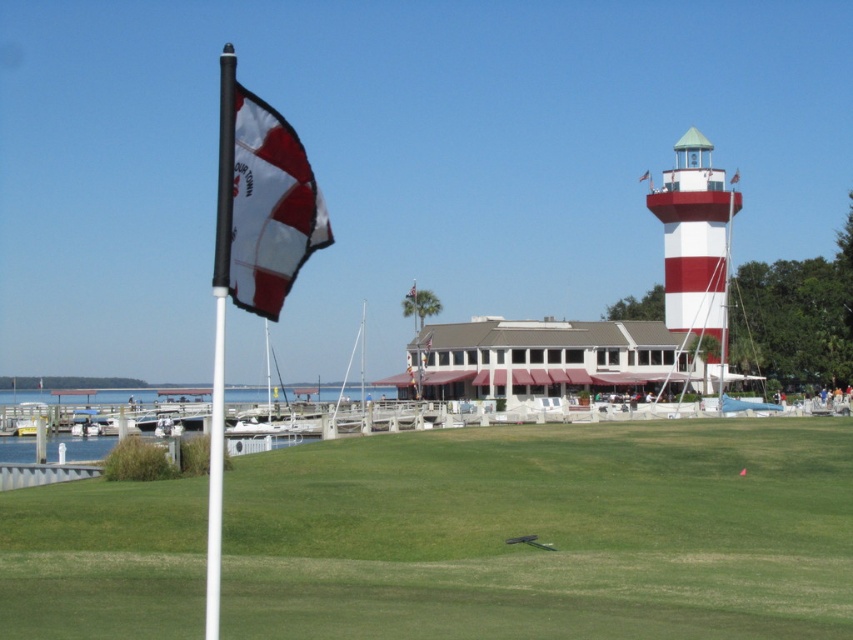
Question: Which point is closer to the camera?

Choices:
 (A) (386, 600)
 (B) (223, 346)
 (C) (682, 301)
 (D) (640, 179)

Answer: (A)

Question: Does white matte flag pole at left have a lesser width compared to white fabric flag at upper center?

Choices:
 (A) yes
 (B) no

Answer: (B)

Question: Among these objects, which one is farthest from the camera?

Choices:
 (A) white matte flag pole at left
 (B) white striped tower at right

Answer: (B)

Question: Can you confirm if green grass at center is positioned to the right of white fabric flag at upper center?

Choices:
 (A) no
 (B) yes

Answer: (A)

Question: Does white striped tower at right appear on the left side of white fabric flag at upper center?

Choices:
 (A) no
 (B) yes

Answer: (A)

Question: Which object is the closest to the white striped tower at right?

Choices:
 (A) white matte flag pole at left
 (B) white fabric flag at upper center
 (C) green grass at center
 (D) white matte flag at left

Answer: (B)